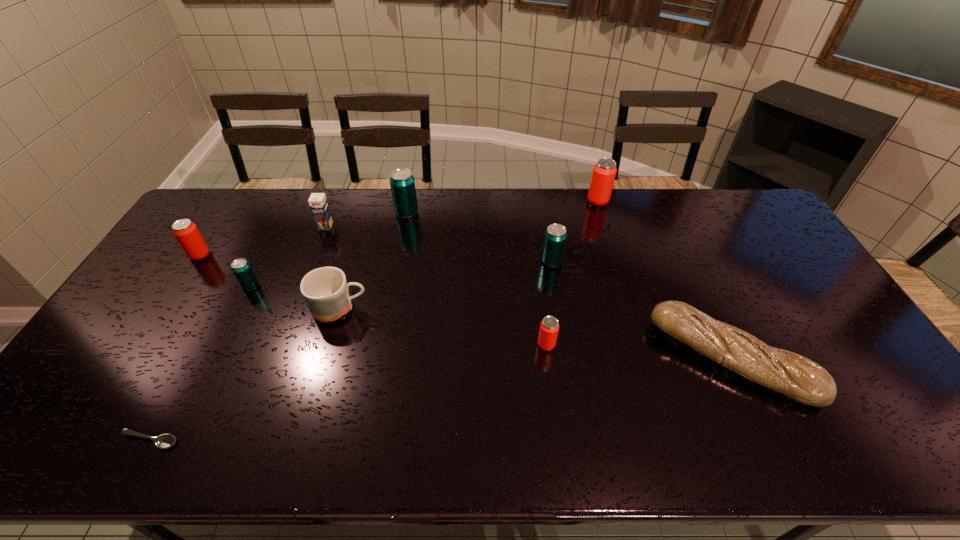
This screenshot has height=540, width=960. Find the location of `blue mug`. blue mug is located at coordinates (325, 290).

In order to click on mug in this screenshot , I will do `click(325, 290)`.

Where is `the fifth beer can from right to left`? the fifth beer can from right to left is located at coordinates (242, 270).

Find the location of a particular element. This screenshot has width=960, height=540. the leftmost teal beer can is located at coordinates 242,270.

You are a GUI agent. You are given a task and a screenshot of the screen. Output one action in this format:
    pyautogui.click(x=<x>, y=<y>)
    Task: Click on the nearest beer can
    
    Given the screenshot: What is the action you would take?
    pyautogui.click(x=549, y=327)

Where is `the second red beer can from left to right`? The width and height of the screenshot is (960, 540). the second red beer can from left to right is located at coordinates (549, 327).

This screenshot has height=540, width=960. In order to click on baguet in this screenshot , I will do `click(786, 372)`.

Find the location of `the shortest object`. the shortest object is located at coordinates (164, 441).

Where is `soupspoon`? This screenshot has width=960, height=540. soupspoon is located at coordinates (164, 441).

I want to click on vacant space situated on the left of the rightmost red beer can, so click(x=573, y=201).